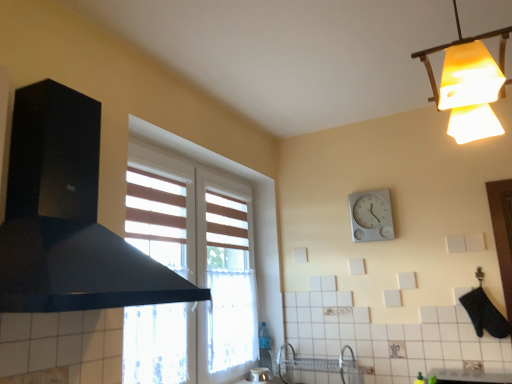
Identify the location of white glossy countertop at lower center. Image resolution: width=512 pixels, height=384 pixels. (470, 376).

Identify the location of black matte exhaust hood at left. Image resolution: width=512 pixels, height=384 pixels. (68, 217).

Describe the element at coordinates (68, 217) in the screenshot. I see `black matte exhaust hood at left` at that location.

Locate an element on the screen. Image resolution: width=512 pixels, height=384 pixels. yellow frosted glass lampshade at upper right is located at coordinates (469, 84).

Locate an element on the screen. white glossy countertop at lower center is located at coordinates (470, 376).

Who is bigger, black matte exhaust hood at left or white plastic wall clock at upper center?

black matte exhaust hood at left.

Considering the positions of points (40, 191) and (385, 207), is point (40, 191) farther from camera compared to point (385, 207)?

No, it is in front of (385, 207).

Is black matte exhaust hood at left facing away from white plastic wall clock at upper center?

black matte exhaust hood at left is not turned away from white plastic wall clock at upper center.

From a real-world perspective, is black matte exhaust hood at left below white plastic wall clock at upper center?

Yes, from a real-world perspective, black matte exhaust hood at left is under white plastic wall clock at upper center.

Can you confirm if white plastic wall clock at upper center is positioned to the right of white glossy countertop at lower center?

In fact, white plastic wall clock at upper center is to the left of white glossy countertop at lower center.

Based on the photo, does white plastic wall clock at upper center have a smaller size compared to white glossy countertop at lower center?

Yes.

This screenshot has height=384, width=512. Identify the location of wall clock above the white glossy countertop at lower center (from a real-world perspective). (371, 216).

Considering the relative positions of yellow frosted glass lampshade at upper right and white plastic wall clock at upper center in the image provided, is yellow frosted glass lampshade at upper right to the right of white plastic wall clock at upper center from the viewer's perspective?

Incorrect, yellow frosted glass lampshade at upper right is not on the right side of white plastic wall clock at upper center.

Considering the points (467, 138) and (377, 233), which point is in front, point (467, 138) or point (377, 233)?

The point (467, 138) is closer.

From a real-world perspective, is yellow frosted glass lampshade at upper right on white plastic wall clock at upper center?

Yes, from a real-world perspective, yellow frosted glass lampshade at upper right is above white plastic wall clock at upper center.

From the image's perspective, which one is positioned higher, white glossy countertop at lower center or white plastic wall clock at upper center?

white plastic wall clock at upper center, from the image's perspective.

From a real-world perspective, is white glossy countertop at lower center located beneath white plastic wall clock at upper center?

Correct, in the physical world, white glossy countertop at lower center is lower than white plastic wall clock at upper center.

Is white glossy countertop at lower center looking in the opposite direction of white plastic wall clock at upper center?

No, white glossy countertop at lower center's orientation is not away from white plastic wall clock at upper center.

Is white glossy countertop at lower center taller or shorter than white plastic wall clock at upper center?

In the image, white glossy countertop at lower center appears to be shorter than white plastic wall clock at upper center.

Considering the relative sizes of white glossy countertop at lower center and black matte exhaust hood at left in the image provided, is white glossy countertop at lower center smaller than black matte exhaust hood at left?

Yes, white glossy countertop at lower center is smaller than black matte exhaust hood at left.

Find the location of a particular element. This screenshot has height=384, width=512. counter top behind the black matte exhaust hood at left is located at coordinates (470, 376).

Can you confirm if white glossy countertop at lower center is positioned to the left of black matte exhaust hood at left?

Incorrect, white glossy countertop at lower center is not on the left side of black matte exhaust hood at left.

In the scene shown: Is black matte exhaust hood at left completely or partially outside of yellow frosted glass lampshade at upper right?

Absolutely, black matte exhaust hood at left is external to yellow frosted glass lampshade at upper right.

How different are the orientations of black matte exhaust hood at left and yellow frosted glass lampshade at upper right in degrees?

The angle between the facing direction of black matte exhaust hood at left and the facing direction of yellow frosted glass lampshade at upper right is 174 degrees.

Is black matte exhaust hood at left wider than yellow frosted glass lampshade at upper right?

Yes, black matte exhaust hood at left is wider than yellow frosted glass lampshade at upper right.

Which is more to the right, white glossy countertop at lower center or yellow frosted glass lampshade at upper right?

From the viewer's perspective, white glossy countertop at lower center appears more on the right side.

From a real-world perspective, does white glossy countertop at lower center stand above yellow frosted glass lampshade at upper right?

No.

Would you say white glossy countertop at lower center is a long distance from yellow frosted glass lampshade at upper right?

That's right, there is a large distance between white glossy countertop at lower center and yellow frosted glass lampshade at upper right.

This screenshot has height=384, width=512. What are the coordinates of `exhaust hood lying on the left of white plastic wall clock at upper center` in the screenshot? It's located at (68, 217).

This screenshot has height=384, width=512. I want to click on wall clock above the white glossy countertop at lower center (from the image's perspective), so click(x=371, y=216).

Which object lies further to the anchor point white glossy countertop at lower center, white plastic wall clock at upper center or black matte exhaust hood at left?

The object further to white glossy countertop at lower center is black matte exhaust hood at left.

Estimate the real-world distances between objects in this image. Which object is further from black matte exhaust hood at left, white glossy countertop at lower center or yellow frosted glass lampshade at upper right?

The object further to black matte exhaust hood at left is white glossy countertop at lower center.

When comparing their distances from white glossy countertop at lower center, does white plastic wall clock at upper center or yellow frosted glass lampshade at upper right seem further?

Among the two, yellow frosted glass lampshade at upper right is located further to white glossy countertop at lower center.

From the image, which object appears to be farther from white plastic wall clock at upper center, black matte exhaust hood at left or yellow frosted glass lampshade at upper right?

The object further to white plastic wall clock at upper center is black matte exhaust hood at left.

Which object lies nearer to the anchor point yellow frosted glass lampshade at upper right, black matte exhaust hood at left or white glossy countertop at lower center?

The object closer to yellow frosted glass lampshade at upper right is black matte exhaust hood at left.

Considering their positions, is white glossy countertop at lower center positioned further to white plastic wall clock at upper center than black matte exhaust hood at left?

Among the two, black matte exhaust hood at left is located further to white plastic wall clock at upper center.

Based on their spatial positions, is yellow frosted glass lampshade at upper right or black matte exhaust hood at left further from white glossy countertop at lower center?

black matte exhaust hood at left.

Looking at this image, looking at the image, which one is located further to yellow frosted glass lampshade at upper right, white glossy countertop at lower center or white plastic wall clock at upper center?

Among the two, white glossy countertop at lower center is located further to yellow frosted glass lampshade at upper right.

The height and width of the screenshot is (384, 512). In order to click on lamp located between black matte exhaust hood at left and white plastic wall clock at upper center in the depth direction in this screenshot , I will do `click(469, 84)`.

Identify the location of counter top located between black matte exhaust hood at left and white plastic wall clock at upper center in the depth direction. Image resolution: width=512 pixels, height=384 pixels. (470, 376).

At what (x,y) coordinates should I click in order to perform the action: click on counter top between yellow frosted glass lampshade at upper right and white plastic wall clock at upper center in the front-back direction. Please return your answer as a coordinate pair (x, y). Image resolution: width=512 pixels, height=384 pixels. Looking at the image, I should click on (470, 376).

This screenshot has height=384, width=512. Find the location of `lamp located between black matte exhaust hood at left and white glossy countertop at lower center in the left-right direction`. lamp located between black matte exhaust hood at left and white glossy countertop at lower center in the left-right direction is located at coordinates (469, 84).